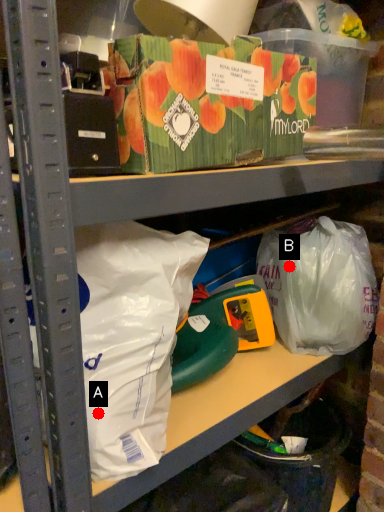
Question: Two points are circled on the image, labeled by A and B beside each circle. Which point is closer to the camera?

Choices:
 (A) A is closer
 (B) B is closer

Answer: (A)